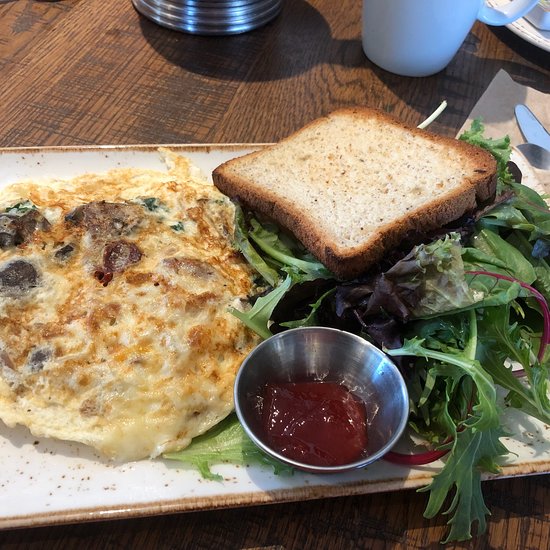
At what (x,y) coordinates should I click in order to perform the action: click on wood grain. Please return your answer as a coordinate pair (x, y). Looking at the image, I should click on (146, 109), (110, 114).